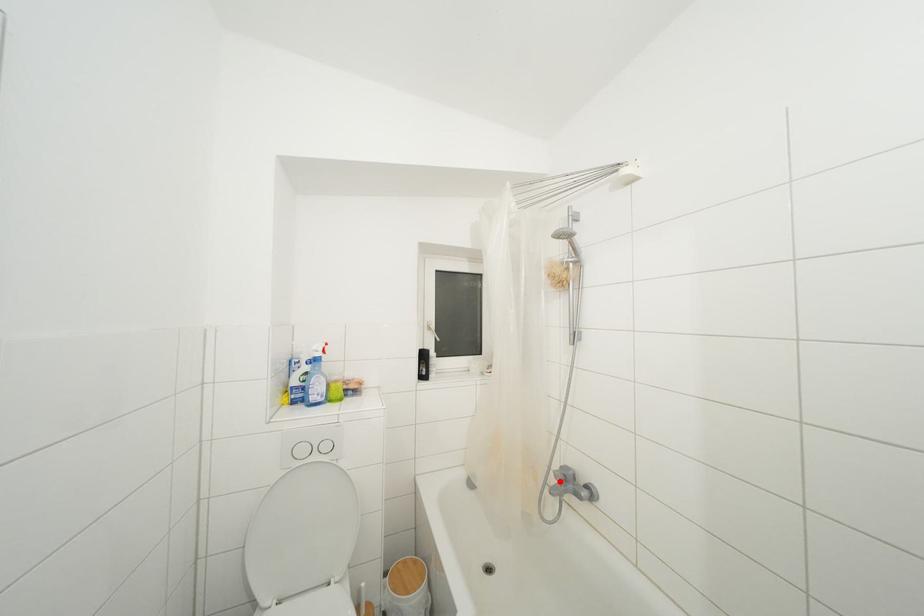
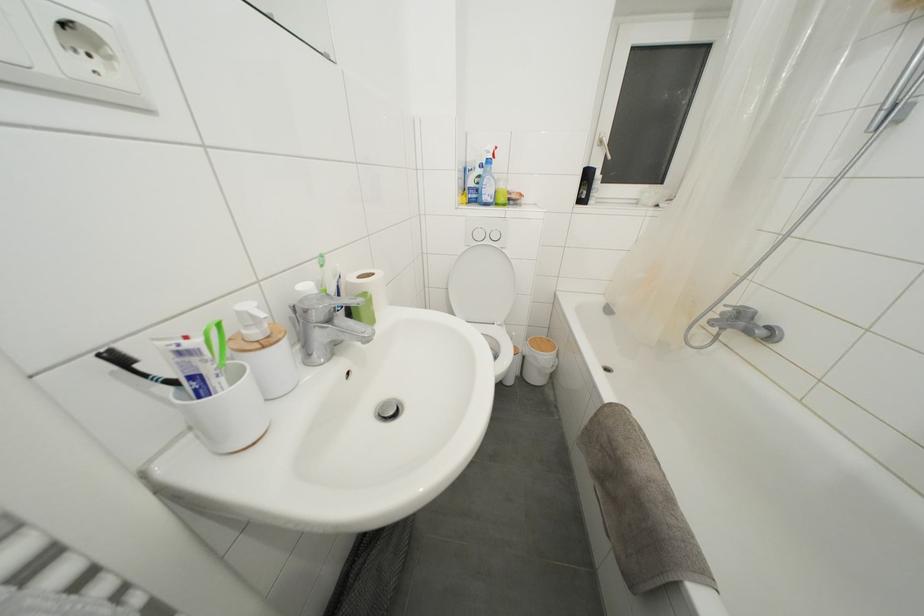
In the second image, find the point that corresponds to the highlighted location in the first image.

(726, 318)